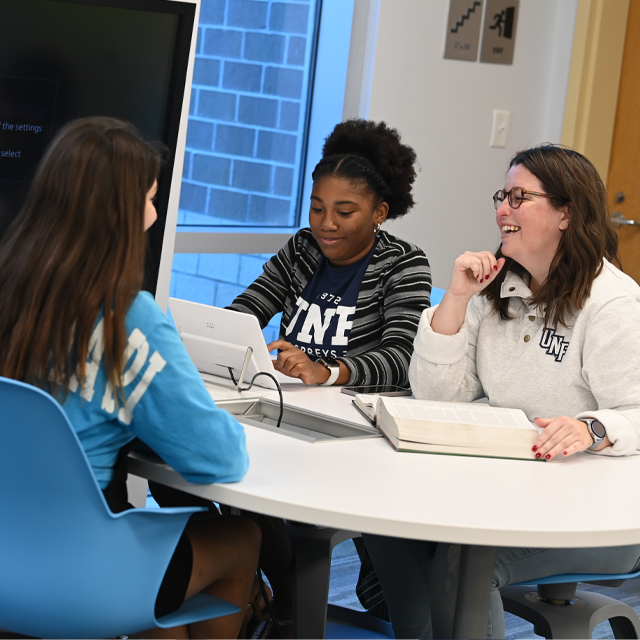
Locate an element on the screen. The image size is (640, 640). text book is located at coordinates (422, 427).